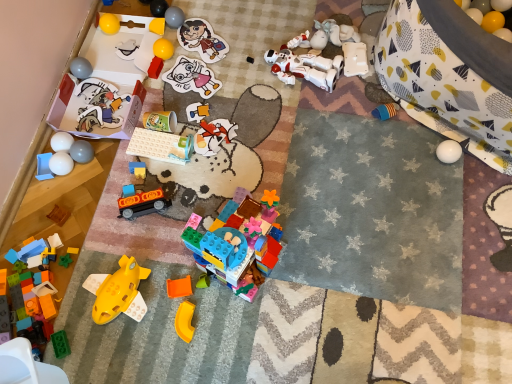
Question: Is yellow rubber ball at upper right, which ranks as the 26th toy in left-to-right order, situated inside blue plastic tray at lower left, the first toy in the left-to-right sequence, or outside?

Choices:
 (A) outside
 (B) inside

Answer: (A)

Question: Considering their positions, is yellow rubber ball at upper right, which ranks as the 26th toy in left-to-right order, located in front of or behind blue plastic tray at lower left, the first toy in the left-to-right sequence?

Choices:
 (A) front
 (B) behind

Answer: (B)

Question: Which of these objects is positioned closest to the matte gray ball at upper center, which ranks as the 10th toy in right-to-left order?

Choices:
 (A) orange plastic toy at center, which is counted as the 22th toy, starting from the left
 (B) orange matte train at center, which is the 13th toy in left-to-right order
 (C) white matte eggs at left, which appears as the 25th toy when viewed from the right
 (D) green matte block at lower left, arranged as the 8th toy when viewed from the left
 (E) white matte robot at upper center, marked as the 24th toy in a left-to-right arrangement

Answer: (E)

Question: Based on their relative distances, which object is farther from the matte gray ball at lower left, marked as the 20th toy in a right-to-left arrangement?

Choices:
 (A) matte paper sticker at center, the eighteenth toy in the left-to-right sequence
 (B) yellow rubber ball at upper right, the first toy from the right
 (C) white matte balls at lower left, positioned as the third toy in left-to-right order
 (D) orange plastic toy at center, acting as the fifth toy starting from the right
 (E) orange matte train at center, acting as the fourteenth toy starting from the right

Answer: (B)